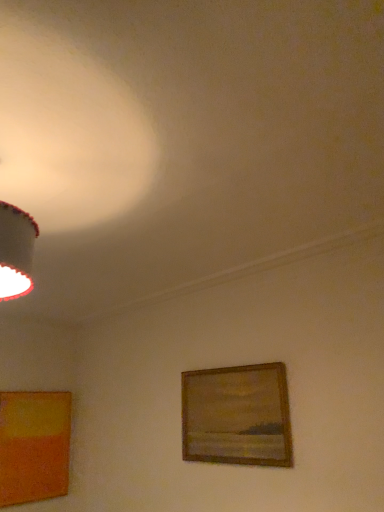
Question: In the image, is wooden picture frame at center, which ranks as the 1th picture frame in right-to-left order, positioned in front of or behind matte orange picture frame at lower left, which is the 1th picture frame from left to right?

Choices:
 (A) front
 (B) behind

Answer: (A)

Question: From the image's perspective, is wooden picture frame at center, which appears as the second picture frame when viewed from the left, positioned above or below matte orange picture frame at lower left, which appears as the 2th picture frame when viewed from the front?

Choices:
 (A) above
 (B) below

Answer: (A)

Question: Is wooden picture frame at center, which appears as the second picture frame when viewed from the left, wider or thinner than matte orange picture frame at lower left, which is the 1th picture frame from left to right?

Choices:
 (A) wide
 (B) thin

Answer: (B)

Question: Visually, is matte orange picture frame at lower left, which appears as the 2th picture frame when viewed from the front, positioned to the left or to the right of wooden picture frame at center, which is the second picture frame from back to front?

Choices:
 (A) left
 (B) right

Answer: (A)

Question: From the image's perspective, is matte orange picture frame at lower left, which is the 1th picture frame in back-to-front order, above or below wooden picture frame at center, which ranks as the 1th picture frame in right-to-left order?

Choices:
 (A) above
 (B) below

Answer: (B)

Question: Considering the positions of matte orange picture frame at lower left, which is the 1th picture frame from left to right, and wooden picture frame at center, the first picture frame when ordered from front to back, in the image, is matte orange picture frame at lower left, which is the 1th picture frame from left to right, wider or thinner than wooden picture frame at center, the first picture frame when ordered from front to back,?

Choices:
 (A) wide
 (B) thin

Answer: (A)

Question: Considering the positions of point (46, 474) and point (261, 434), is point (46, 474) closer or farther from the camera than point (261, 434)?

Choices:
 (A) closer
 (B) farther

Answer: (B)